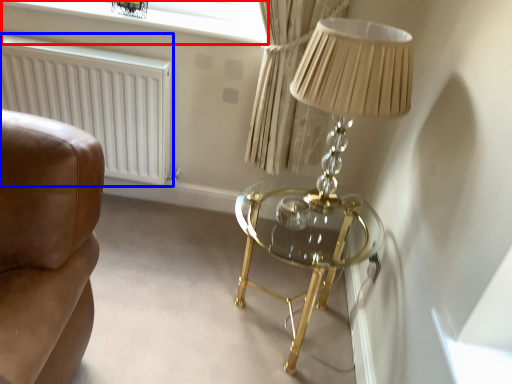
Question: Among these objects, which one is farthest to the camera, window screen (highlighted by a red box) or radiator (highlighted by a blue box)?

Choices:
 (A) window screen
 (B) radiator

Answer: (A)